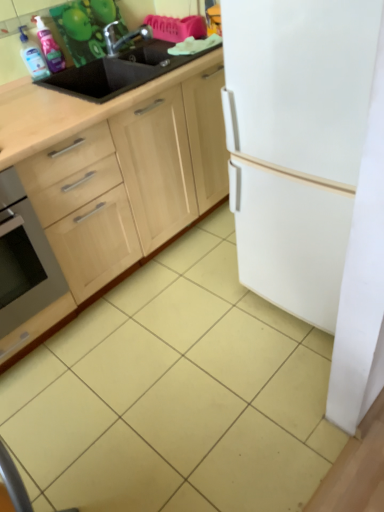
This screenshot has width=384, height=512. What do you see at coordinates (71, 111) in the screenshot?
I see `black matte sink at upper left` at bounding box center [71, 111].

Identify the location of stainless steel oven at lower left. (24, 258).

The height and width of the screenshot is (512, 384). In order to click on yellow matte tile at lower left in this screenshot , I will do `click(56, 426)`.

Describe the element at coordinates (32, 57) in the screenshot. I see `translucent plastic bottle at upper left, the second cleaning product when ordered from right to left` at that location.

This screenshot has width=384, height=512. What do you see at coordinates (50, 47) in the screenshot? I see `translucent plastic spray bottle at upper left, marked as the 2th cleaning product in a left-to-right arrangement` at bounding box center [50, 47].

Where is `metallic silver faucet at upper left`? The height and width of the screenshot is (512, 384). metallic silver faucet at upper left is located at coordinates (123, 37).

Can you confirm if wooden cabinet at center is positioned to the right of stainless steel oven at lower left?

Correct, you'll find wooden cabinet at center to the right of stainless steel oven at lower left.

Looking at their sizes, would you say wooden cabinet at center is wider or thinner than stainless steel oven at lower left?

Considering their sizes, wooden cabinet at center looks slimmer than stainless steel oven at lower left.

From the image's perspective, between wooden cabinet at center and stainless steel oven at lower left, which one is located above?

From the image's view, wooden cabinet at center is above.

Is there a large distance between wooden cabinet at center and stainless steel oven at lower left?

wooden cabinet at center is near stainless steel oven at lower left, not far away.

Is translucent plastic bottle at upper left, the second cleaning product when ordered from right to left, facing away from translucent plastic spray bottle at upper left, marked as the first cleaning product in a right-to-left arrangement?

No.

Is translucent plastic bottle at upper left, which appears as the 1th cleaning product when viewed from the left, not near translucent plastic spray bottle at upper left, marked as the 2th cleaning product in a left-to-right arrangement?

translucent plastic bottle at upper left, which appears as the 1th cleaning product when viewed from the left, is near translucent plastic spray bottle at upper left, marked as the 2th cleaning product in a left-to-right arrangement, not far away.

Does point (28, 59) lie behind point (45, 26)?

That is False.

Is translucent plastic bottle at upper left, the second cleaning product when ordered from right to left, at the right side of translucent plastic spray bottle at upper left, marked as the 2th cleaning product in a left-to-right arrangement?

In fact, translucent plastic bottle at upper left, the second cleaning product when ordered from right to left, is to the left of translucent plastic spray bottle at upper left, marked as the 2th cleaning product in a left-to-right arrangement.

From their relative heights in the image, would you say metallic silver faucet at upper left is taller or shorter than white matte refrigerator at right?

In the image, metallic silver faucet at upper left appears to be shorter than white matte refrigerator at right.

Which object is positioned more to the right, metallic silver faucet at upper left or white matte refrigerator at right?

white matte refrigerator at right is more to the right.

The width and height of the screenshot is (384, 512). In order to click on tap that is above the white matte refrigerator at right (from a real-world perspective) in this screenshot , I will do `click(123, 37)`.

Is translucent plastic bottle at upper left, the second cleaning product when ordered from right to left, oriented away from stainless steel oven at lower left?

No.

Is translucent plastic bottle at upper left, which appears as the 1th cleaning product when viewed from the left, further to the viewer compared to stainless steel oven at lower left?

Yes, it is.

From a real-world perspective, is translucent plastic bottle at upper left, the second cleaning product when ordered from right to left, physically above stainless steel oven at lower left?

Yes, from a real-world perspective, translucent plastic bottle at upper left, the second cleaning product when ordered from right to left, is over stainless steel oven at lower left

Would you consider translucent plastic bottle at upper left, which appears as the 1th cleaning product when viewed from the left, to be distant from stainless steel oven at lower left?

translucent plastic bottle at upper left, which appears as the 1th cleaning product when viewed from the left, is actually quite close to stainless steel oven at lower left.

Considering the sizes of objects metallic silver faucet at upper left and translucent plastic bottle at upper left, the second cleaning product when ordered from right to left, in the image provided, who is smaller, metallic silver faucet at upper left or translucent plastic bottle at upper left, the second cleaning product when ordered from right to left,?

With smaller size is translucent plastic bottle at upper left, the second cleaning product when ordered from right to left.

From a real-world perspective, between metallic silver faucet at upper left and translucent plastic bottle at upper left, which appears as the 1th cleaning product when viewed from the left, who is vertically higher?

From a 3D spatial view, translucent plastic bottle at upper left, which appears as the 1th cleaning product when viewed from the left, is above.

Is there a large distance between metallic silver faucet at upper left and translucent plastic bottle at upper left, which appears as the 1th cleaning product when viewed from the left?

No, metallic silver faucet at upper left is in close proximity to translucent plastic bottle at upper left, which appears as the 1th cleaning product when viewed from the left.

From the image's perspective, is wooden cabinet at center located above translucent plastic bottle at upper left, which appears as the 1th cleaning product when viewed from the left?

No, from the image's perspective, wooden cabinet at center is not over translucent plastic bottle at upper left, which appears as the 1th cleaning product when viewed from the left.

Is wooden cabinet at center positioned far away from translucent plastic bottle at upper left, the second cleaning product when ordered from right to left?

wooden cabinet at center is near translucent plastic bottle at upper left, the second cleaning product when ordered from right to left, not far away.

Looking at the image, does wooden cabinet at center seem bigger or smaller compared to translucent plastic bottle at upper left, the second cleaning product when ordered from right to left?

wooden cabinet at center is bigger than translucent plastic bottle at upper left, the second cleaning product when ordered from right to left.

Considering their positions, is wooden cabinet at center located in front of or behind translucent plastic bottle at upper left, the second cleaning product when ordered from right to left?

wooden cabinet at center is positioned closer to the viewer than translucent plastic bottle at upper left, the second cleaning product when ordered from right to left.

Can you tell me how much black matte sink at upper left and translucent plastic spray bottle at upper left, marked as the 2th cleaning product in a left-to-right arrangement, differ in facing direction?

The angle between the facing direction of black matte sink at upper left and the facing direction of translucent plastic spray bottle at upper left, marked as the 2th cleaning product in a left-to-right arrangement, is 5.28 degrees.

Who is smaller, black matte sink at upper left or translucent plastic spray bottle at upper left, marked as the 2th cleaning product in a left-to-right arrangement?

translucent plastic spray bottle at upper left, marked as the 2th cleaning product in a left-to-right arrangement, is smaller.

Is black matte sink at upper left looking in the opposite direction of translucent plastic spray bottle at upper left, marked as the 2th cleaning product in a left-to-right arrangement?

That's not correct — black matte sink at upper left is not looking away from translucent plastic spray bottle at upper left, marked as the 2th cleaning product in a left-to-right arrangement.

What are the coordinates of `cabinetry located on the right of stainless steel oven at lower left` in the screenshot? It's located at (115, 176).

You are a GUI agent. You are given a task and a screenshot of the screen. Output one action in this format:
    pyautogui.click(x=<x>, y=<y>)
    Task: Click on the cleaning product located in front of the translucent plastic spray bottle at upper left, marked as the first cleaning product in a right-to-left arrangement
    
    Given the screenshot: What is the action you would take?
    pyautogui.click(x=32, y=57)

Considering their positions, is black matte sink at upper left positioned further to translucent plastic bottle at upper left, the second cleaning product when ordered from right to left, than stainless steel oven at lower left?

Based on the image, stainless steel oven at lower left appears to be further to translucent plastic bottle at upper left, the second cleaning product when ordered from right to left.

Estimate the real-world distances between objects in this image. Which object is further from yellow matte tile at lower left, translucent plastic spray bottle at upper left, marked as the 2th cleaning product in a left-to-right arrangement, or wooden cabinet at center?

translucent plastic spray bottle at upper left, marked as the 2th cleaning product in a left-to-right arrangement, is further to yellow matte tile at lower left.

Considering their positions, is translucent plastic bottle at upper left, which appears as the 1th cleaning product when viewed from the left, positioned closer to translucent plastic spray bottle at upper left, marked as the first cleaning product in a right-to-left arrangement, than black matte sink at upper left?

The object closer to translucent plastic spray bottle at upper left, marked as the first cleaning product in a right-to-left arrangement, is translucent plastic bottle at upper left, which appears as the 1th cleaning product when viewed from the left.

When comparing their distances from yellow matte tile at lower left, does black matte sink at upper left or translucent plastic bottle at upper left, the second cleaning product when ordered from right to left, seem further?

translucent plastic bottle at upper left, the second cleaning product when ordered from right to left.

Looking at the image, which one is located closer to wooden cabinet at center, translucent plastic spray bottle at upper left, marked as the 2th cleaning product in a left-to-right arrangement, or white matte refrigerator at right?

white matte refrigerator at right.

When comparing their distances from wooden cabinet at center, does metallic silver faucet at upper left or translucent plastic spray bottle at upper left, marked as the 2th cleaning product in a left-to-right arrangement, seem closer?

translucent plastic spray bottle at upper left, marked as the 2th cleaning product in a left-to-right arrangement, is closer to wooden cabinet at center.

Looking at the image, which one is located closer to black matte sink at upper left, stainless steel oven at lower left or metallic silver faucet at upper left?

stainless steel oven at lower left lies closer to black matte sink at upper left than the other object.

When comparing their distances from black matte sink at upper left, does white matte refrigerator at right or metallic silver faucet at upper left seem further?

Based on the image, white matte refrigerator at right appears to be further to black matte sink at upper left.

Identify the location of home appliance between translucent plastic spray bottle at upper left, marked as the 2th cleaning product in a left-to-right arrangement, and yellow matte tile at lower left in the up-down direction. The width and height of the screenshot is (384, 512). (24, 258).

Where is `countertop between translucent plastic spray bottle at upper left, marked as the first cleaning product in a right-to-left arrangement, and stainless steel oven at lower left vertically`? The height and width of the screenshot is (512, 384). countertop between translucent plastic spray bottle at upper left, marked as the first cleaning product in a right-to-left arrangement, and stainless steel oven at lower left vertically is located at coordinates (71, 111).

Where is `tap between translucent plastic bottle at upper left, the second cleaning product when ordered from right to left, and white matte refrigerator at right from left to right`? tap between translucent plastic bottle at upper left, the second cleaning product when ordered from right to left, and white matte refrigerator at right from left to right is located at coordinates (123, 37).

Find the location of a particular element. This screenshot has height=512, width=384. countertop between wooden cabinet at center and metallic silver faucet at upper left from front to back is located at coordinates (71, 111).